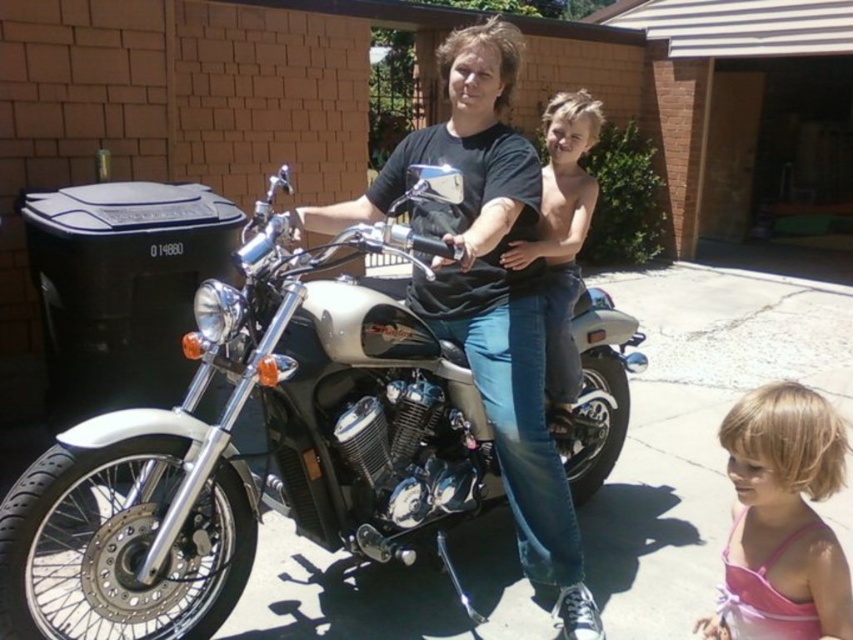
You are standing at the origin point in the scene. Where is the white metallic motorcycle at center located in terms of coordinates?

The white metallic motorcycle at center is located at coordinates point [265,444].